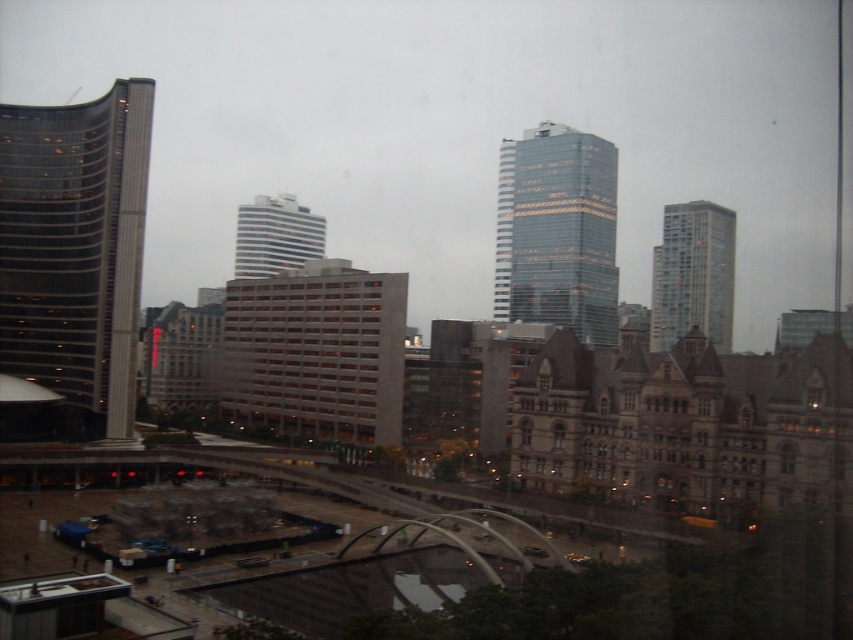
Question: Which object is positioned farthest from the brown brick building at center?

Choices:
 (A) shiny glass skyscraper at center
 (B) glassy reflective tower at right
 (C) white glossy building at center

Answer: (C)

Question: Which of these objects is positioned farthest from the white glossy building at center?

Choices:
 (A) brown brick building at center
 (B) shiny glass skyscraper at center

Answer: (A)

Question: Is shiny glass skyscraper at center smaller than white glossy building at center?

Choices:
 (A) yes
 (B) no

Answer: (B)

Question: Which object appears farthest from the camera in this image?

Choices:
 (A) brown brick building at center
 (B) shiny glass skyscraper at center

Answer: (B)

Question: Is glassy reflective skyscraper at left smaller than white glossy building at center?

Choices:
 (A) no
 (B) yes

Answer: (B)

Question: Is glassy reflective skyscraper at left wider than glassy reflective tower at right?

Choices:
 (A) yes
 (B) no

Answer: (B)